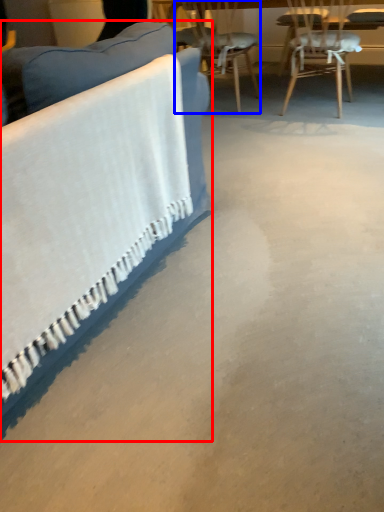
Question: Which of the following is the closest to the observer, studio couch (highlighted by a red box) or chair (highlighted by a blue box)?

Choices:
 (A) studio couch
 (B) chair

Answer: (A)